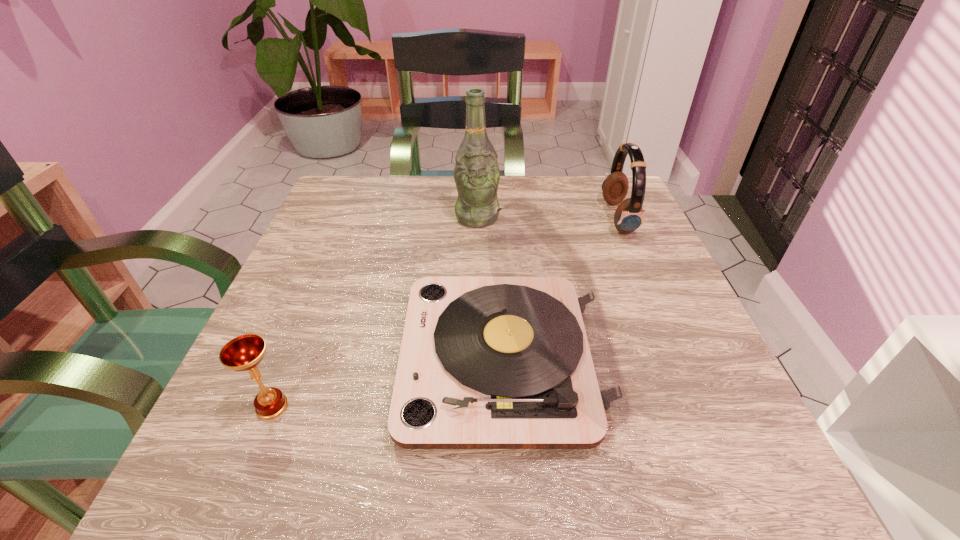
You are a GUI agent. You are given a task and a screenshot of the screen. Output one action in this format:
    pyautogui.click(x=<x>, y=<y>)
    Task: Click on the beer bottle
    The image size is (960, 540).
    Given the screenshot: What is the action you would take?
    pyautogui.click(x=476, y=173)

Find the location of a particular element. This screenshot has height=540, width=960. record player is located at coordinates (524, 359).

Where is `headset`? Image resolution: width=960 pixels, height=540 pixels. headset is located at coordinates (629, 215).

Locate an element on the screen. The height and width of the screenshot is (540, 960). the rightmost object is located at coordinates (629, 215).

Find the location of `the shortest object`. the shortest object is located at coordinates (244, 353).

Image resolution: width=960 pixels, height=540 pixels. I want to click on the leftmost object, so click(244, 353).

Identify the location of vacant position located on the surface of the beer bottle. This screenshot has width=960, height=540. (477, 243).

Where is `free point located with the tonearm facing the front of the record player`? The width and height of the screenshot is (960, 540). free point located with the tonearm facing the front of the record player is located at coordinates (259, 360).

Find the location of a particular element. vacant region located 0.050m with the tonearm facing the front of the record player is located at coordinates (372, 360).

The height and width of the screenshot is (540, 960). Identify the location of vacant region located with the tonearm facing the front of the record player. (372, 360).